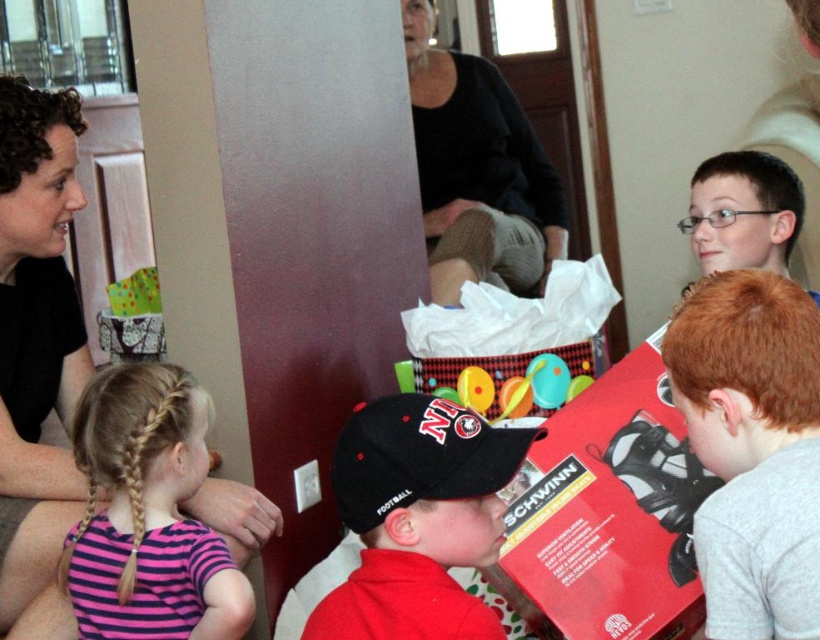
Between point (709, 444) and point (403, 538), which one is positioned behind?

The point (709, 444) is behind.

Image resolution: width=820 pixels, height=640 pixels. What do you see at coordinates (750, 445) in the screenshot?
I see `light gray cotton shirt at lower right` at bounding box center [750, 445].

Find the location of `light gray cotton shirt at lower right`. light gray cotton shirt at lower right is located at coordinates (750, 445).

Can you confirm if pink striped shirt at lower left is positioned above matte plastic toy at center?

No.

Between pink striped shirt at lower left and matte plastic toy at center, which one is positioned lower?

pink striped shirt at lower left is below.

Between point (242, 616) and point (590, 358), which one is positioned behind?

Positioned behind is point (590, 358).

Locate an element on the screen. The width and height of the screenshot is (820, 640). pink striped shirt at lower left is located at coordinates (148, 515).

This screenshot has height=640, width=820. What do you see at coordinates (35, 339) in the screenshot? I see `matte black shirt at left` at bounding box center [35, 339].

Is matte black shirt at left to the left of matte plastic toy at center from the viewer's perspective?

Yes, matte black shirt at left is to the left of matte plastic toy at center.

Who is more forward, (23, 88) or (529, 374)?

Point (23, 88) is more forward.

Locate an element on the screen. The height and width of the screenshot is (640, 820). matte black shirt at left is located at coordinates (35, 339).